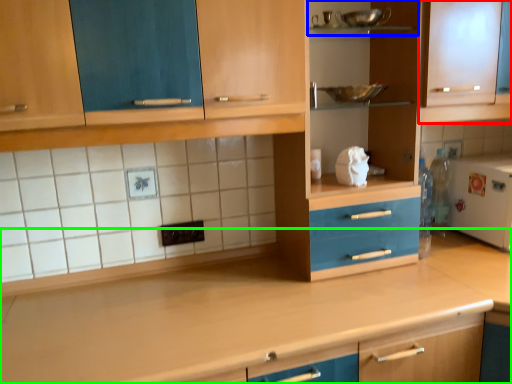
Question: Which is nearer to the cabinetry (highlighted by a red box)? shelf (highlighted by a blue box) or countertop (highlighted by a green box).

Choices:
 (A) shelf
 (B) countertop

Answer: (A)